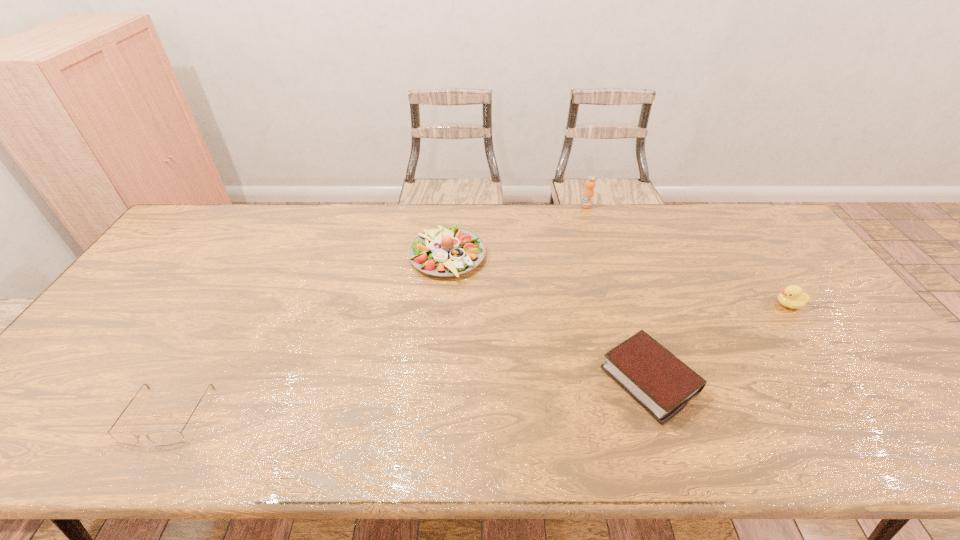
I want to click on the tallest object, so 588,194.

Locate an element on the screen. orange juice is located at coordinates (588, 194).

Identify the location of salad plate. (445, 251).

The height and width of the screenshot is (540, 960). In order to click on the fourth object from right to left in this screenshot , I will do `click(445, 251)`.

Where is `the third nearest object`? the third nearest object is located at coordinates (792, 296).

Identify the location of duckling. (792, 296).

The height and width of the screenshot is (540, 960). Identify the location of Bible. (660, 382).

I want to click on spectacles, so click(x=167, y=437).

Identify the location of free spot located 0.250m on the front label of the orange juice. point(601,253).

Locate an element on the screen. The image size is (960, 540). vacant space located on the right of the fourth object from right to left is located at coordinates (594, 256).